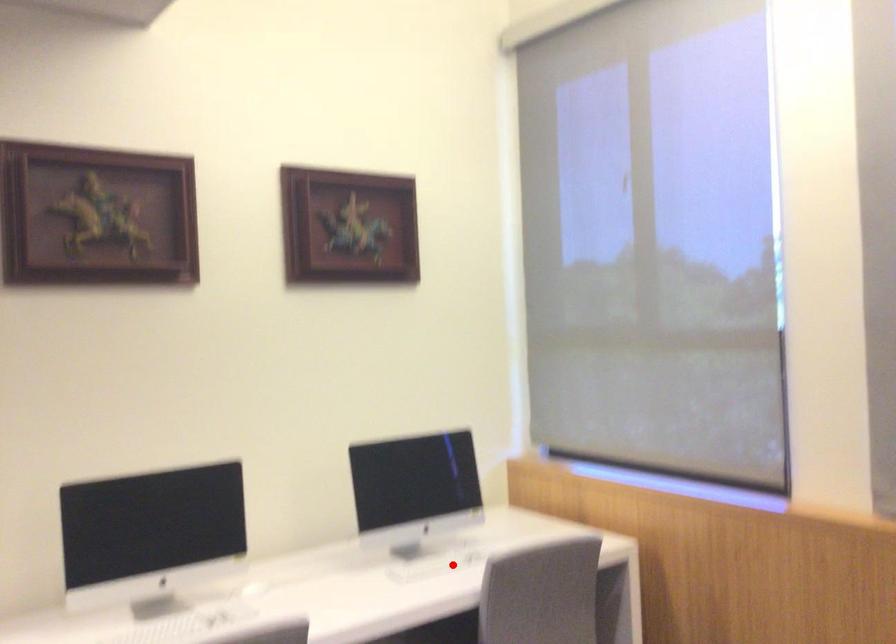
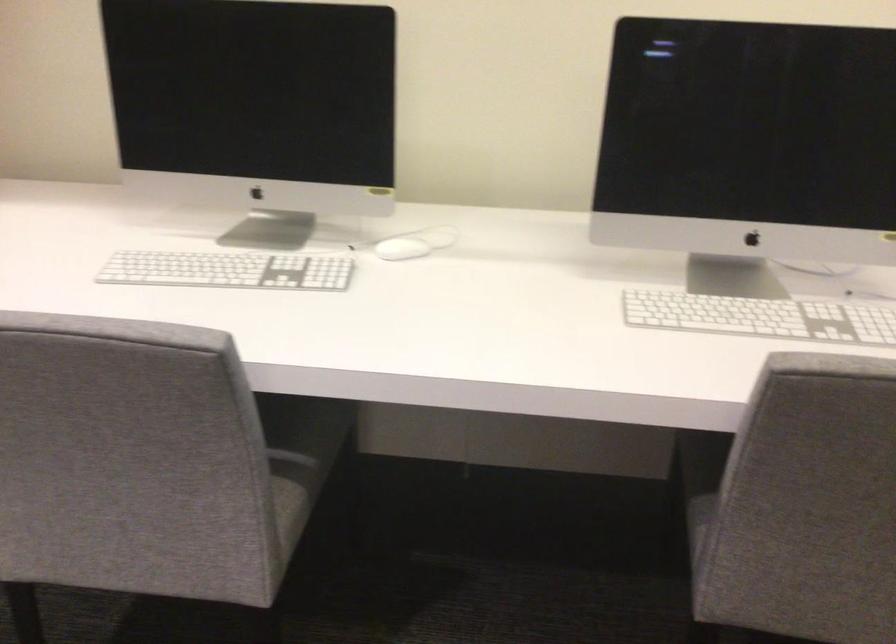
In the second image, find the point that corresponds to the highlighted location in the first image.

(760, 317)